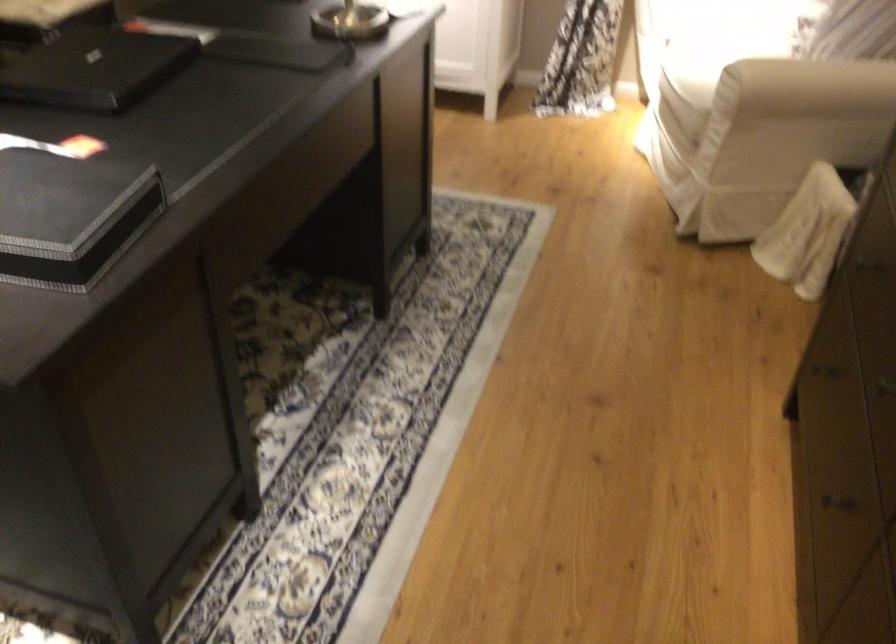
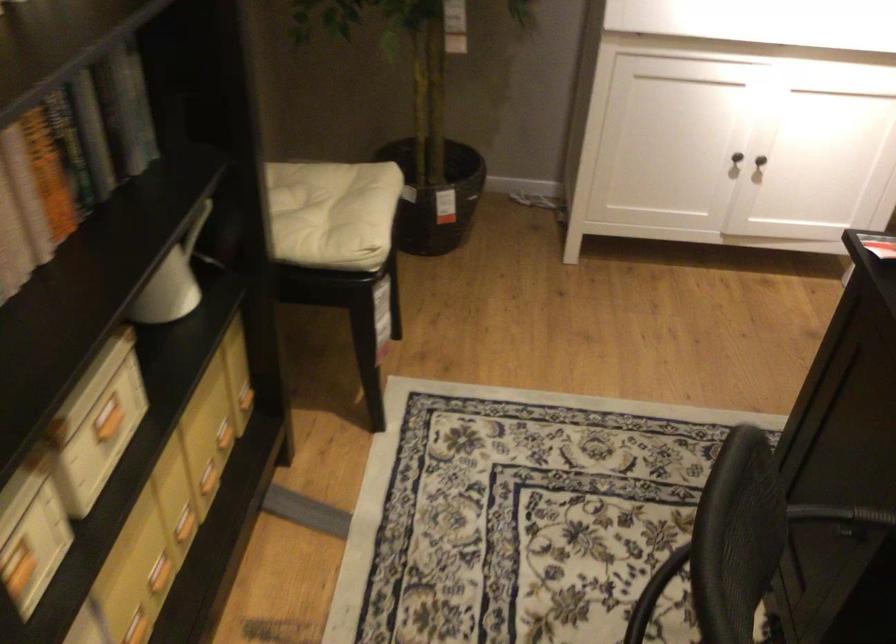
The images are taken continuously from a first-person perspective. In which direction are you moving?

The movement direction of the cameraman is left, forward.